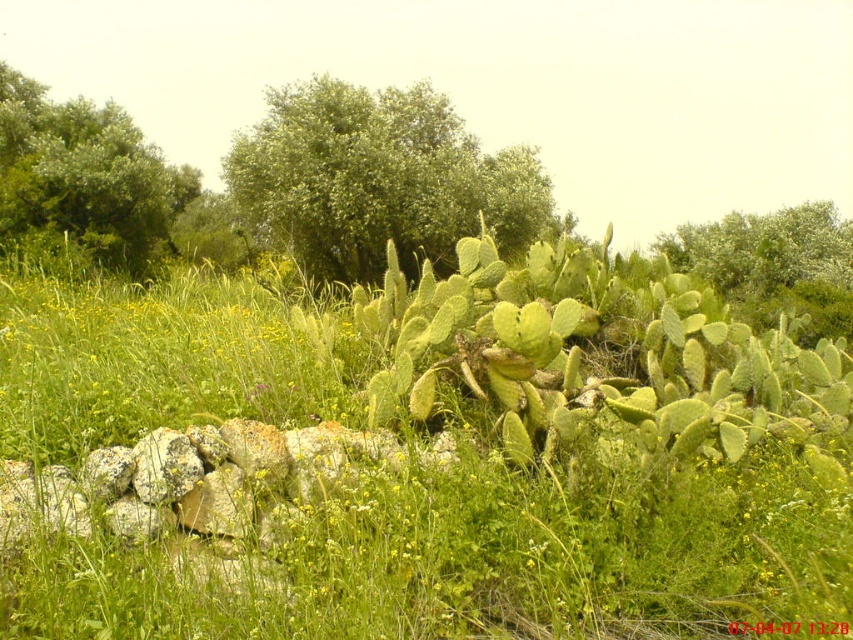
Does green leafy tree at center have a greater width compared to green leafy tree at upper center?

Correct, the width of green leafy tree at center exceeds that of green leafy tree at upper center.

Looking at this image, can you confirm if green leafy tree at center is bigger than green leafy tree at upper center?

Yes.

Is point (332, 259) behind point (816, 268)?

No, it is in front of (816, 268).

Locate an element on the screen. green leafy tree at center is located at coordinates (376, 179).

Does green leafy tree at upper left have a greater height compared to green leafy tree at upper center?

Indeed, green leafy tree at upper left has a greater height compared to green leafy tree at upper center.

Does green leafy tree at upper left have a lesser width compared to green leafy tree at upper center?

Yes, green leafy tree at upper left is thinner than green leafy tree at upper center.

At what (x,y) coordinates should I click in order to perform the action: click on green leafy tree at upper left. Please return your answer as a coordinate pair (x, y). This screenshot has height=640, width=853. Looking at the image, I should click on (83, 179).

Who is shorter, green leafy tree at center or green leafy tree at upper left?

green leafy tree at upper left is shorter.

At what (x,y) coordinates should I click in order to perform the action: click on green leafy tree at center. Please return your answer as a coordinate pair (x, y). The width and height of the screenshot is (853, 640). Looking at the image, I should click on (376, 179).

Find the location of a particular element. This screenshot has height=640, width=853. green leafy tree at center is located at coordinates (376, 179).